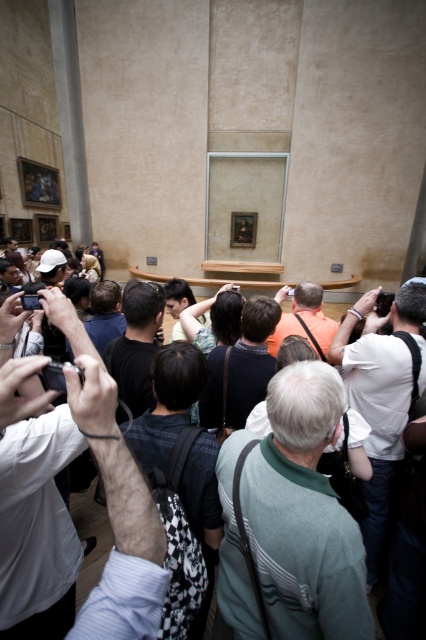
You are standing at the entrance of the museum and want to take a photo of the painting. There are two people blocking your view at coordinates point (x=298, y=625) and point (x=23, y=403). Which person should you ask to move so you can see the painting better?

You should ask point (x=23, y=403) to move because point (x=298, y=625) is behind point (x=23, y=403), so moving the person in front would allow you to see the painting better.

You are standing in the museum and want to take a photo of the painting without anyone blocking your view. You have a matte black camera at center. Is there enough space between you and the green striped sweater at center to take the photo?

The green striped sweater at center is further to the viewer than the matte black camera at center, meaning the sweater is closer to you. Since the sweater is in front of the camera, it would block your view. Therefore, there isn not enough space to take the photo without obstruction.

You are a photographer holding a white matte camera at center. You want to take a photo of the painting but there is a person wearing a green striped sweater at center blocking your view. Can you move the camera to the side to get a clear shot without moving the person?

The green striped sweater at center might be wider than white matte camera at center, so there is a possibility that moving the camera to the side could allow you to avoid the obstruction and capture the painting without disturbing the person.